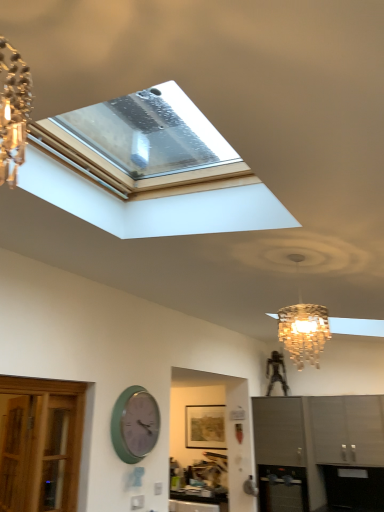
What is the approximate height of metallic stainless steel oven at lower center?

metallic stainless steel oven at lower center is 23.34 inches tall.

At what (x,y) coordinates should I click in order to perform the action: click on matte gray cabinet at lower right, which is counted as the 1th cabinetry, starting from the left. Please return your answer as a coordinate pair (x, y). Looking at the image, I should click on (318, 434).

I want to click on green matte wall clock at lower left, so click(135, 424).

This screenshot has width=384, height=512. In order to click on satin gray cabinet at lower right, which is counted as the first cabinetry, starting from the right in this screenshot , I will do `click(348, 429)`.

Considering the sizes of satin gray cabinet at lower right, which is the second cabinetry from left to right, and metallic stainless steel oven at lower center in the image, is satin gray cabinet at lower right, which is the second cabinetry from left to right, bigger or smaller than metallic stainless steel oven at lower center?

Considering their sizes, satin gray cabinet at lower right, which is the second cabinetry from left to right, takes up more space than metallic stainless steel oven at lower center.

From the picture: From a real-world perspective, who is located lower, satin gray cabinet at lower right, which is counted as the first cabinetry, starting from the right, or metallic stainless steel oven at lower center?

metallic stainless steel oven at lower center.

Does satin gray cabinet at lower right, which is the second cabinetry from left to right, have a greater width compared to metallic stainless steel oven at lower center?

No, satin gray cabinet at lower right, which is the second cabinetry from left to right, is not wider than metallic stainless steel oven at lower center.

Is point (339, 419) in front of point (274, 498)?

Yes, point (339, 419) is closer to viewer.

From the image's perspective, does green matte wall clock at lower left appear higher than metallic stainless steel oven at lower center?

Yes, from the image's perspective, green matte wall clock at lower left is over metallic stainless steel oven at lower center.

Considering their positions, is green matte wall clock at lower left located in front of or behind metallic stainless steel oven at lower center?

green matte wall clock at lower left is positioned closer to the viewer than metallic stainless steel oven at lower center.

From a real-world perspective, is green matte wall clock at lower left below metallic stainless steel oven at lower center?

Actually, green matte wall clock at lower left is physically above metallic stainless steel oven at lower center in the real world.

Is matte gray cabinet at lower right, marked as the 2th cabinetry in a right-to-left arrangement, to the left of satin gray cabinet at lower right, which is the second cabinetry from left to right, from the viewer's perspective?

Yes.

From a real-world perspective, is matte gray cabinet at lower right, which is counted as the 1th cabinetry, starting from the left, located higher than satin gray cabinet at lower right, which is the second cabinetry from left to right?

No, from a real-world perspective, matte gray cabinet at lower right, which is counted as the 1th cabinetry, starting from the left, is not above satin gray cabinet at lower right, which is the second cabinetry from left to right.

Based on their sizes in the image, would you say matte gray cabinet at lower right, which is counted as the 1th cabinetry, starting from the left, is bigger or smaller than satin gray cabinet at lower right, which is the second cabinetry from left to right?

matte gray cabinet at lower right, which is counted as the 1th cabinetry, starting from the left, is bigger than satin gray cabinet at lower right, which is the second cabinetry from left to right.

Can you tell me how much matte gray cabinet at lower right, marked as the 2th cabinetry in a right-to-left arrangement, and satin gray cabinet at lower right, which is counted as the first cabinetry, starting from the right, differ in facing direction?

The facing directions of matte gray cabinet at lower right, marked as the 2th cabinetry in a right-to-left arrangement, and satin gray cabinet at lower right, which is counted as the first cabinetry, starting from the right, are 0.294 degrees apart.

Find the location of a particular element. cabinetry that is the 1st object located above the metallic stainless steel oven at lower center (from the image's perspective) is located at coordinates (318, 434).

Is matte gray cabinet at lower right, which is counted as the 1th cabinetry, starting from the left, closer to the viewer compared to metallic stainless steel oven at lower center?

Yes, it is in front of metallic stainless steel oven at lower center.

From the image's perspective, which is below, matte gray cabinet at lower right, marked as the 2th cabinetry in a right-to-left arrangement, or metallic stainless steel oven at lower center?

metallic stainless steel oven at lower center appears lower in the image.

How far apart are matte gray cabinet at lower right, which is counted as the 1th cabinetry, starting from the left, and metallic stainless steel oven at lower center?

A distance of 18.77 inches exists between matte gray cabinet at lower right, which is counted as the 1th cabinetry, starting from the left, and metallic stainless steel oven at lower center.

Does metallic stainless steel oven at lower center lie behind matte gray cabinet at lower right, marked as the 2th cabinetry in a right-to-left arrangement?

Yes, metallic stainless steel oven at lower center is further from the viewer.

Does metallic stainless steel oven at lower center have a lesser height compared to matte gray cabinet at lower right, which is counted as the 1th cabinetry, starting from the left?

Correct, metallic stainless steel oven at lower center is not as tall as matte gray cabinet at lower right, which is counted as the 1th cabinetry, starting from the left.

Find the location of a particular element. cabinetry located in front of the metallic stainless steel oven at lower center is located at coordinates (318, 434).

Is metallic stainless steel oven at lower center completely or partially outside of matte gray cabinet at lower right, which is counted as the 1th cabinetry, starting from the left?

That's incorrect, metallic stainless steel oven at lower center is not completely outside matte gray cabinet at lower right, which is counted as the 1th cabinetry, starting from the left.

Measure the distance between green matte wall clock at lower left and satin gray cabinet at lower right, which is counted as the first cabinetry, starting from the right.

green matte wall clock at lower left and satin gray cabinet at lower right, which is counted as the first cabinetry, starting from the right, are 9.38 feet apart from each other.

Is point (154, 406) less distant than point (349, 439)?

Yes, point (154, 406) is closer to viewer.

Considering the sizes of objects green matte wall clock at lower left and satin gray cabinet at lower right, which is counted as the first cabinetry, starting from the right, in the image provided, who is wider, green matte wall clock at lower left or satin gray cabinet at lower right, which is counted as the first cabinetry, starting from the right,?

satin gray cabinet at lower right, which is counted as the first cabinetry, starting from the right, is wider.

Considering the relative sizes of green matte wall clock at lower left and satin gray cabinet at lower right, which is the second cabinetry from left to right, in the image provided, is green matte wall clock at lower left smaller than satin gray cabinet at lower right, which is the second cabinetry from left to right,?

Yes, green matte wall clock at lower left is smaller than satin gray cabinet at lower right, which is the second cabinetry from left to right.

Is there a large distance between green matte wall clock at lower left and matte gray cabinet at lower right, which is counted as the 1th cabinetry, starting from the left?

That's right, there is a large distance between green matte wall clock at lower left and matte gray cabinet at lower right, which is counted as the 1th cabinetry, starting from the left.

Considering the positions of points (139, 438) and (365, 419), is point (139, 438) closer to camera compared to point (365, 419)?

That is True.

From the image's perspective, between green matte wall clock at lower left and matte gray cabinet at lower right, marked as the 2th cabinetry in a right-to-left arrangement, who is located below?

From the image's view, matte gray cabinet at lower right, marked as the 2th cabinetry in a right-to-left arrangement, is below.

Identify the location of wall clock in front of the matte gray cabinet at lower right, marked as the 2th cabinetry in a right-to-left arrangement. The image size is (384, 512). (135, 424).

There is a metallic stainless steel oven at lower center. In order to click on the 2nd cabinetry above it (from the image's perspective) in this screenshot , I will do `click(348, 429)`.

Identify the location of wall clock above the metallic stainless steel oven at lower center (from a real-world perspective). The height and width of the screenshot is (512, 384). (135, 424).

From the image, which object appears to be farther from matte gray cabinet at lower right, marked as the 2th cabinetry in a right-to-left arrangement, metallic stainless steel oven at lower center or green matte wall clock at lower left?

Among the two, green matte wall clock at lower left is located further to matte gray cabinet at lower right, marked as the 2th cabinetry in a right-to-left arrangement.

Which object lies nearer to the anchor point green matte wall clock at lower left, satin gray cabinet at lower right, which is counted as the first cabinetry, starting from the right, or metallic stainless steel oven at lower center?

The object closer to green matte wall clock at lower left is metallic stainless steel oven at lower center.

Considering their positions, is satin gray cabinet at lower right, which is the second cabinetry from left to right, positioned further to matte gray cabinet at lower right, marked as the 2th cabinetry in a right-to-left arrangement, than green matte wall clock at lower left?

Among the two, green matte wall clock at lower left is located further to matte gray cabinet at lower right, marked as the 2th cabinetry in a right-to-left arrangement.

When comparing their distances from matte gray cabinet at lower right, marked as the 2th cabinetry in a right-to-left arrangement, does green matte wall clock at lower left or satin gray cabinet at lower right, which is counted as the first cabinetry, starting from the right, seem further?

green matte wall clock at lower left lies further to matte gray cabinet at lower right, marked as the 2th cabinetry in a right-to-left arrangement, than the other object.

Which object lies further to the anchor point metallic stainless steel oven at lower center, green matte wall clock at lower left or satin gray cabinet at lower right, which is counted as the first cabinetry, starting from the right?

Among the two, green matte wall clock at lower left is located further to metallic stainless steel oven at lower center.

Which object lies nearer to the anchor point satin gray cabinet at lower right, which is counted as the first cabinetry, starting from the right, green matte wall clock at lower left or metallic stainless steel oven at lower center?

metallic stainless steel oven at lower center is closer to satin gray cabinet at lower right, which is counted as the first cabinetry, starting from the right.

From the image, which object appears to be farther from satin gray cabinet at lower right, which is the second cabinetry from left to right, metallic stainless steel oven at lower center or matte gray cabinet at lower right, marked as the 2th cabinetry in a right-to-left arrangement?

Based on the image, metallic stainless steel oven at lower center appears to be further to satin gray cabinet at lower right, which is the second cabinetry from left to right.

Based on their spatial positions, is metallic stainless steel oven at lower center or satin gray cabinet at lower right, which is the second cabinetry from left to right, further from matte gray cabinet at lower right, marked as the 2th cabinetry in a right-to-left arrangement?

metallic stainless steel oven at lower center lies further to matte gray cabinet at lower right, marked as the 2th cabinetry in a right-to-left arrangement, than the other object.

Image resolution: width=384 pixels, height=512 pixels. I want to click on appliance between green matte wall clock at lower left and satin gray cabinet at lower right, which is the second cabinetry from left to right, in the horizontal direction, so click(282, 489).

Locate an element on the screen. The height and width of the screenshot is (512, 384). cabinetry between green matte wall clock at lower left and satin gray cabinet at lower right, which is counted as the first cabinetry, starting from the right is located at coordinates (318, 434).

Identify the location of appliance located between matte gray cabinet at lower right, which is counted as the 1th cabinetry, starting from the left, and satin gray cabinet at lower right, which is the second cabinetry from left to right, in the left-right direction. This screenshot has width=384, height=512. (282, 489).

Find the location of a particular element. cabinetry located between green matte wall clock at lower left and metallic stainless steel oven at lower center in the left-right direction is located at coordinates (318, 434).